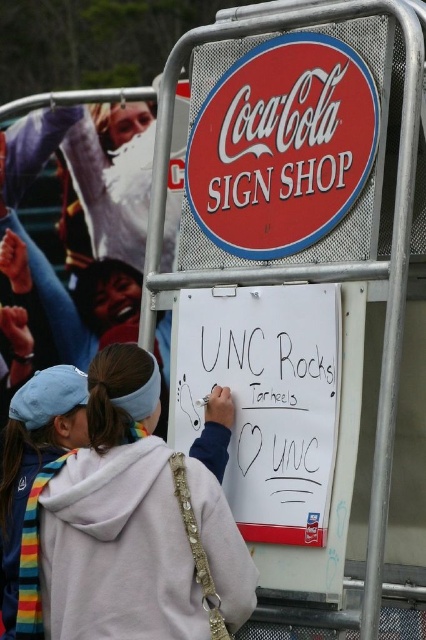
Is white fleece hoodie at center bigger than red plastic coca-cola sign shop at upper center?

Yes, white fleece hoodie at center is bigger than red plastic coca-cola sign shop at upper center.

Is white fleece hoodie at center to the left of red plastic coca-cola sign shop at upper center from the viewer's perspective?

Yes, white fleece hoodie at center is to the left of red plastic coca-cola sign shop at upper center.

You are a GUI agent. You are given a task and a screenshot of the screen. Output one action in this format:
    pyautogui.click(x=<x>, y=<y>)
    Task: Click on the white fleece hoodie at center
    The height and width of the screenshot is (640, 426).
    Given the screenshot: What is the action you would take?
    pyautogui.click(x=135, y=525)

Is point (270, 48) in front of point (330, 486)?

No, it is not.

Which of these two, red plastic coca-cola sign shop at upper center or white paperboard at center, stands shorter?

With less height is white paperboard at center.

Is point (345, 209) more distant than point (287, 483)?

No, it is in front of (287, 483).

Where is `red plastic coca-cola sign shop at upper center`? The image size is (426, 640). red plastic coca-cola sign shop at upper center is located at coordinates (282, 147).

Locate an element on the screen. This screenshot has width=426, height=640. white fleece hoodie at center is located at coordinates (135, 525).

Where is `white fleece hoodie at center`? This screenshot has width=426, height=640. white fleece hoodie at center is located at coordinates (135, 525).